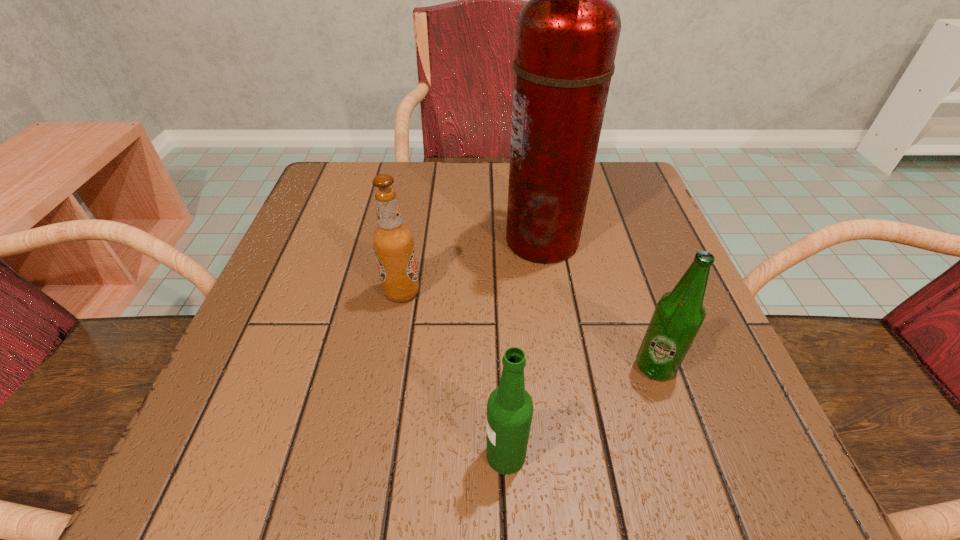
Identify the location of vacant space located 0.140m on the side of the farthest object with the handle and hose. (434, 240).

This screenshot has height=540, width=960. Find the location of `vacant area situated 0.150m on the front label of the farthest beer bottle`. vacant area situated 0.150m on the front label of the farthest beer bottle is located at coordinates (507, 292).

The height and width of the screenshot is (540, 960). In order to click on vacant point located 0.130m on the label of the rightmost beer bottle in this screenshot , I will do `click(693, 476)`.

Where is `free location located on the label of the nearest object`? The image size is (960, 540). free location located on the label of the nearest object is located at coordinates (431, 455).

You are a GUI agent. You are given a task and a screenshot of the screen. Output one action in this format:
    pyautogui.click(x=<x>, y=<y>)
    Task: Click on the vacant space located on the label of the nearest object
    The width and height of the screenshot is (960, 540).
    Given the screenshot: What is the action you would take?
    pyautogui.click(x=202, y=455)

Find the location of a particular element. The image size is (960, 540). blank space located on the label of the nearest object is located at coordinates (383, 455).

Locate an element on the screen. object located in the far edge section of the desktop is located at coordinates (567, 34).

Where is `object at the near edge`? object at the near edge is located at coordinates (510, 407).

This screenshot has height=540, width=960. I want to click on object present at the right edge, so click(679, 314).

At what (x,y) coordinates should I click in order to perform the action: click on free space at the far edge of the desktop. Please return your answer as a coordinate pair (x, y). The image size is (960, 540). Looking at the image, I should click on (494, 183).